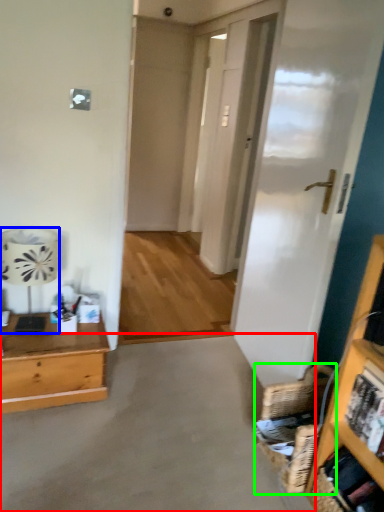
Question: Estimate the real-world distances between objects in this image. Which object is closer to concrete (highlighted by a red box), lamp (highlighted by a blue box) or basket (highlighted by a green box)?

Choices:
 (A) lamp
 (B) basket

Answer: (B)